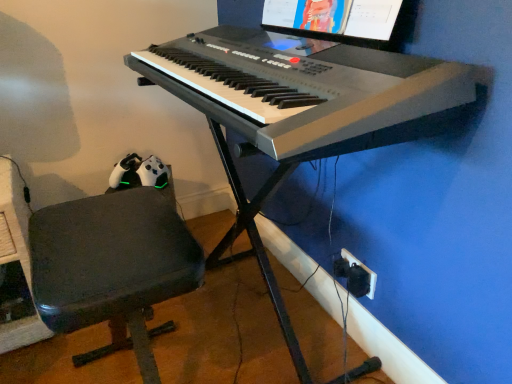
Question: From their relative heights in the image, would you say white plastic keyboard at center is taller or shorter than matte black monitor at upper center?

Choices:
 (A) short
 (B) tall

Answer: (B)

Question: From the image's perspective, is white plastic keyboard at center positioned above or below matte black monitor at upper center?

Choices:
 (A) above
 (B) below

Answer: (B)

Question: Estimate the real-world distances between objects in this image. Which object is farther from the black plastic plug at lower right?

Choices:
 (A) dark gray fabric chair at lower left
 (B) white plastic keyboard at center
 (C) matte black monitor at upper center
 (D) white plastic keyboard at center

Answer: (A)

Question: Which object is the closest to the matte black monitor at upper center?

Choices:
 (A) dark gray fabric chair at lower left
 (B) black plastic plug at lower right
 (C) white plastic keyboard at center
 (D) white plastic keyboard at center

Answer: (C)